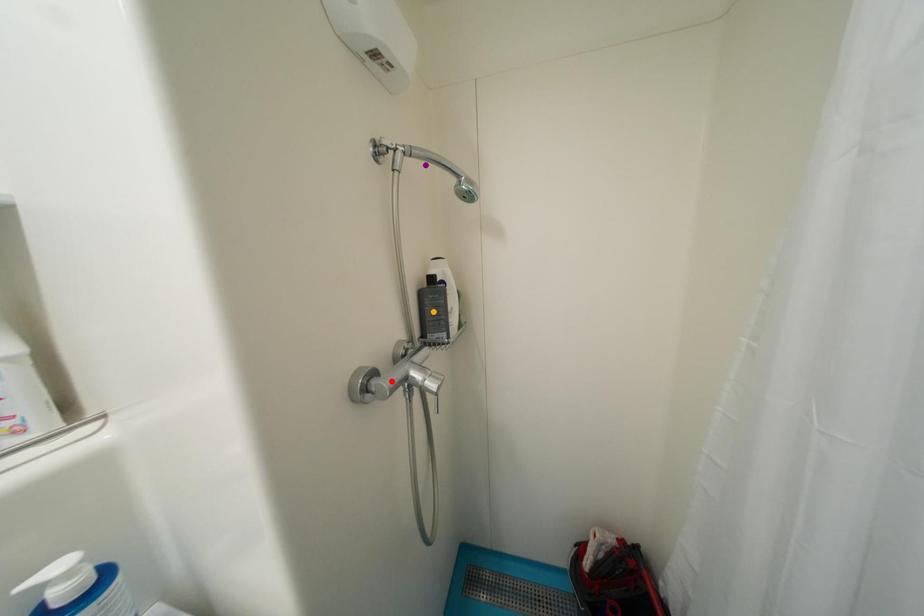
Order these from farthest to nearest:
red point, orange point, purple point

orange point, red point, purple point